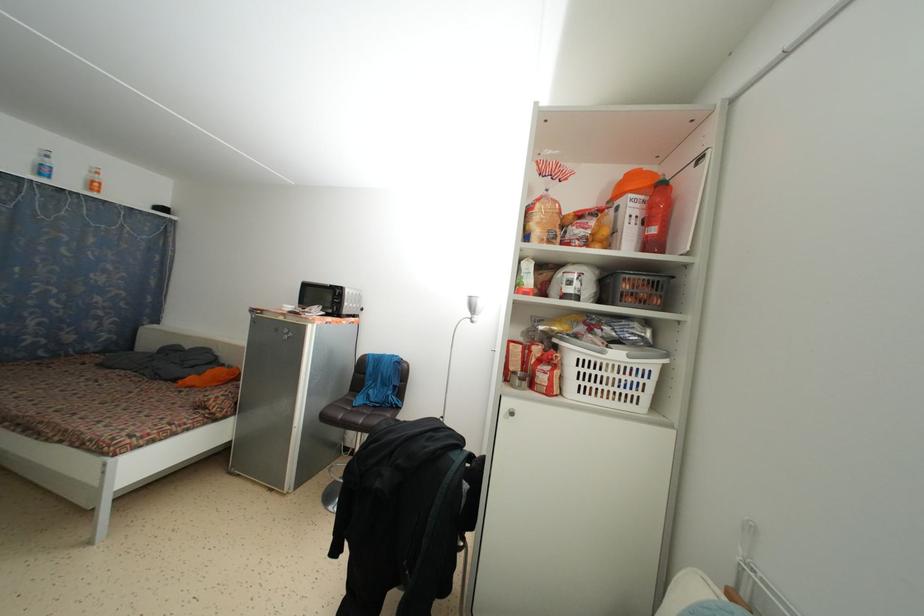
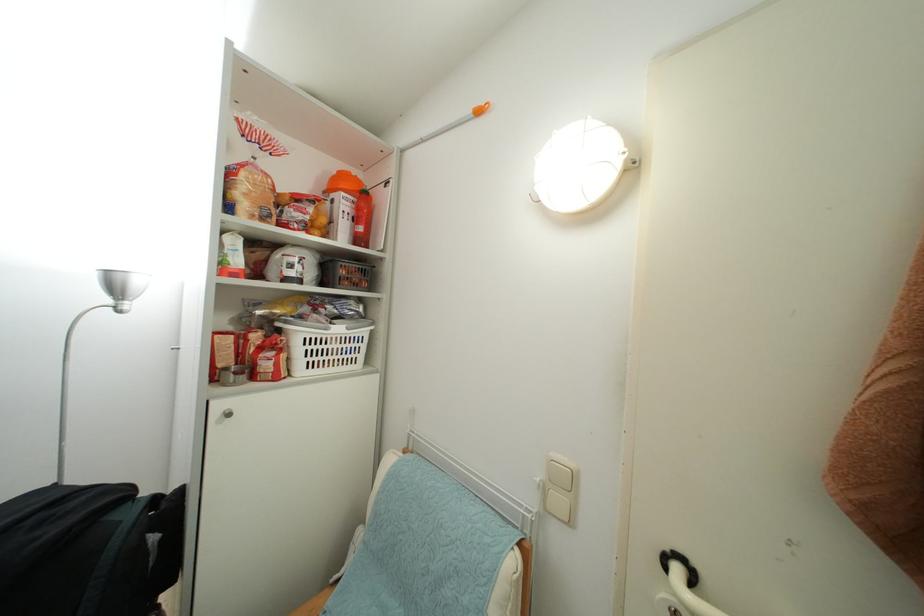
Where in the second image is the point corresponding to the point at 553,374 from the first image?

(276, 359)